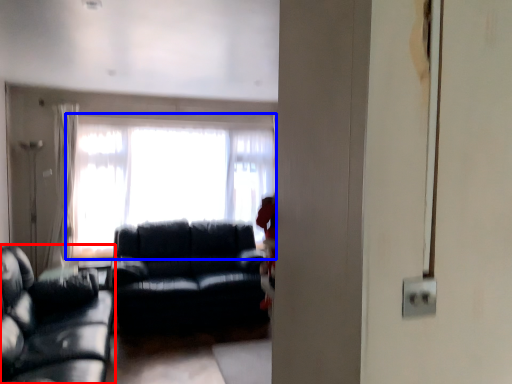
Question: Among these objects, which one is farthest to the camera, studio couch (highlighted by a red box) or window (highlighted by a blue box)?

Choices:
 (A) studio couch
 (B) window

Answer: (B)